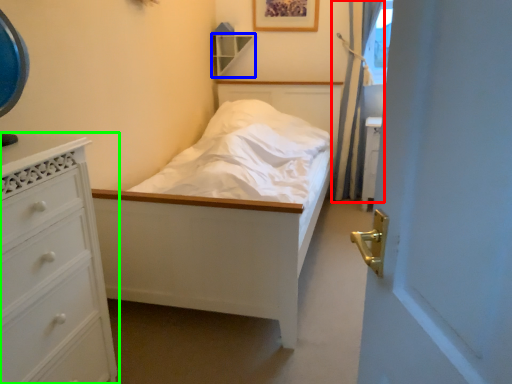
Question: Which object is positioned closest to curtain (highlighted by a red box)? Select from shelf (highlighted by a blue box) and chest of drawers (highlighted by a green box).

Choices:
 (A) shelf
 (B) chest of drawers

Answer: (A)